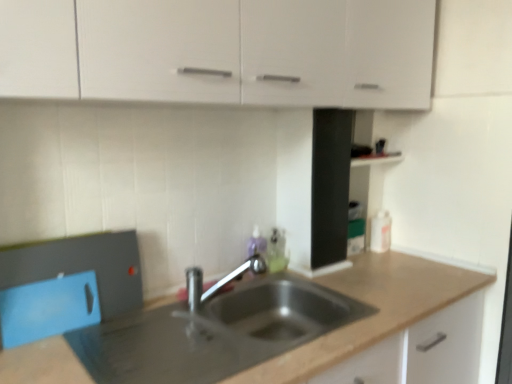
Identify the location of vacant area that lies in front of polished chrome tap at center. Image resolution: width=512 pixels, height=384 pixels. tap(210, 340).